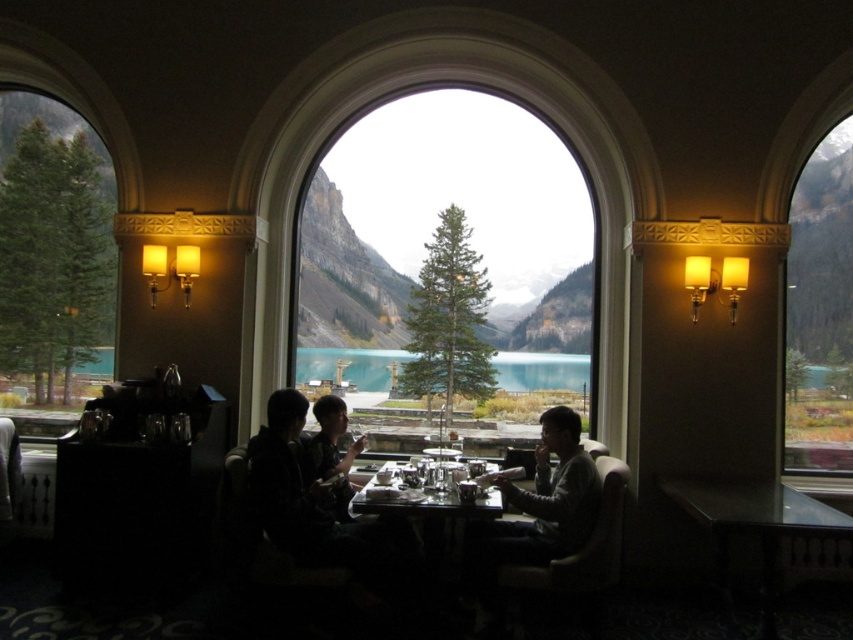
Question: Is the position of metallic silver dinnerware at center less distant than that of dark gray sweater at center?

Choices:
 (A) yes
 (B) no

Answer: (A)

Question: Which of the following is the farthest from the observer?

Choices:
 (A) (770, 508)
 (B) (827, 390)
 (C) (538, 468)

Answer: (B)

Question: Which object is farther from the camera taking this photo?

Choices:
 (A) dark gray hoodie at center
 (B) dark gray sweater at center

Answer: (B)

Question: Based on their relative distances, which object is nearer to the transparent glass window at center?

Choices:
 (A) gray sweater at center
 (B) metallic silver dinnerware at center

Answer: (B)

Question: Does gray sweater at center have a larger size compared to dark gray sweater at center?

Choices:
 (A) no
 (B) yes

Answer: (B)

Question: Does transparent glass window at center appear under metallic silver dinnerware at center?

Choices:
 (A) no
 (B) yes

Answer: (A)